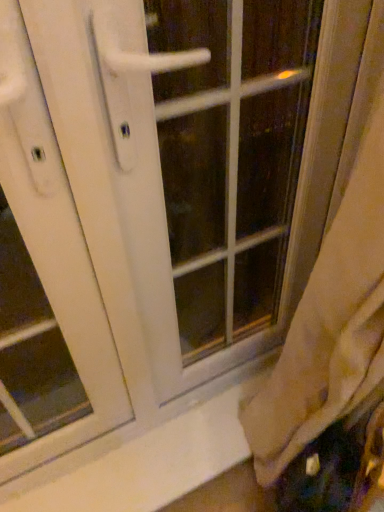
Question: Visually, is white glossy door handle at center positioned to the left or to the right of white smooth window sill at lower center?

Choices:
 (A) left
 (B) right

Answer: (B)

Question: In the image, is white glossy door handle at center positioned in front of or behind white smooth window sill at lower center?

Choices:
 (A) behind
 (B) front

Answer: (B)

Question: Estimate the real-world distances between objects in this image. Which object is closer to the white smooth window sill at lower center?

Choices:
 (A) white plastic screen door at left
 (B) white glossy door handle at center

Answer: (A)

Question: Based on their relative distances, which object is farther from the white smooth window sill at lower center?

Choices:
 (A) white glossy door handle at center
 (B) white plastic screen door at left

Answer: (A)